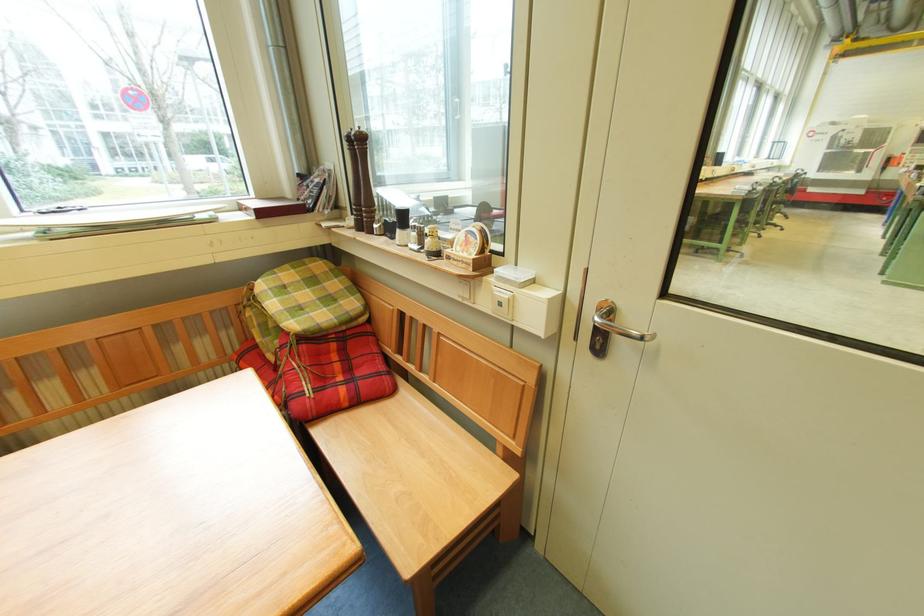
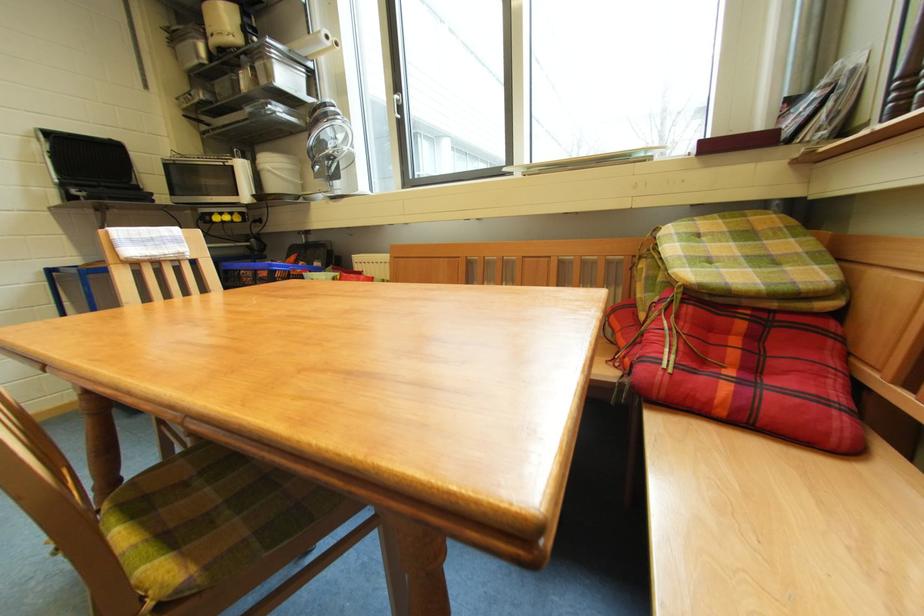
Question: I am providing you with two images of the same scene from different viewpoints. Please identify which objects are invisible in image2.

Choices:
 (A) small chrome fan
 (B) white window handle
 (C) black grill handle
 (D) none of these

Answer: (D)